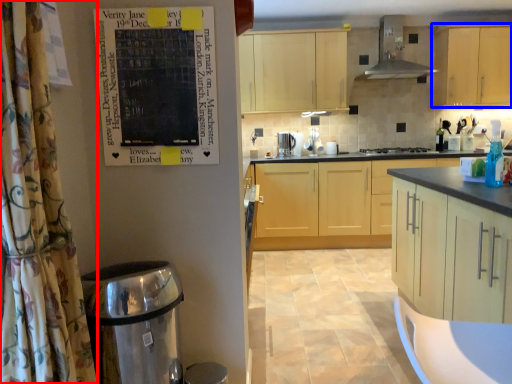
Question: Among these objects, which one is farthest to the camera, shower curtain (highlighted by a red box) or cabinetry (highlighted by a blue box)?

Choices:
 (A) shower curtain
 (B) cabinetry

Answer: (B)